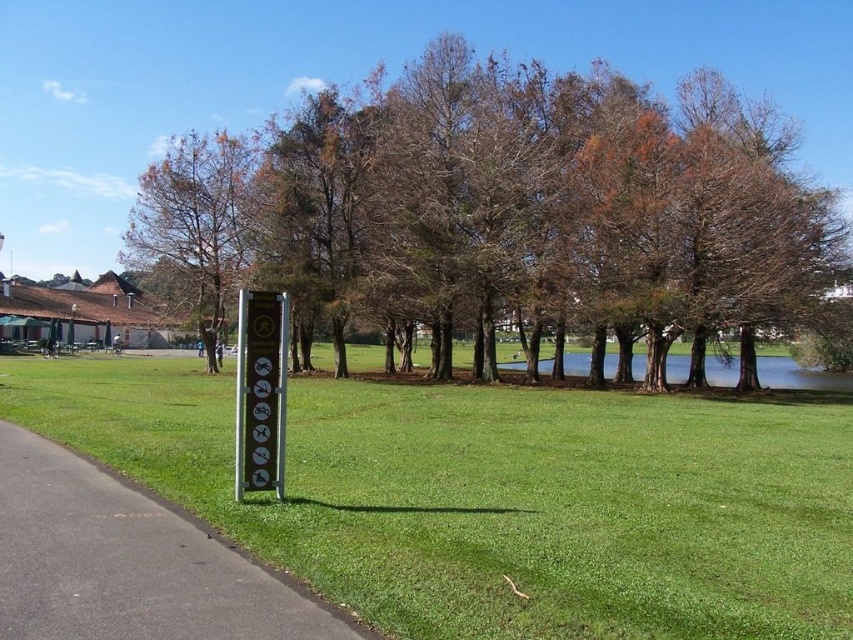
In the scene shown: Is green grassy at center below green grassy lake at center?

Incorrect, green grassy at center is not positioned below green grassy lake at center.

Who is more forward, (100, 433) or (781, 358)?

Point (100, 433)

This screenshot has width=853, height=640. Find the location of `green grassy at center`. green grassy at center is located at coordinates (498, 497).

Is brown/dry wood trees at center thinner than brown/dried wood tree at center?

Yes.

Can you confirm if brown/dry wood trees at center is bigger than brown/dried wood tree at center?

No.

This screenshot has width=853, height=640. I want to click on brown/dry wood trees at center, so click(x=497, y=208).

Identify the location of green grassy at center. This screenshot has width=853, height=640. (498, 497).

Does green grassy at center have a lesser height compared to metallic sign at center?

Correct, green grassy at center is not as tall as metallic sign at center.

Identify the location of green grassy at center. Image resolution: width=853 pixels, height=640 pixels. (498, 497).